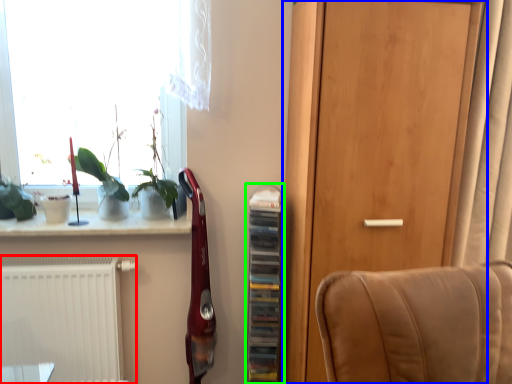
Question: Considering the real-world distances, which object is farthest from radiator (highlighted by a red box)? door (highlighted by a blue box) or shelf (highlighted by a green box)?

Choices:
 (A) door
 (B) shelf

Answer: (A)